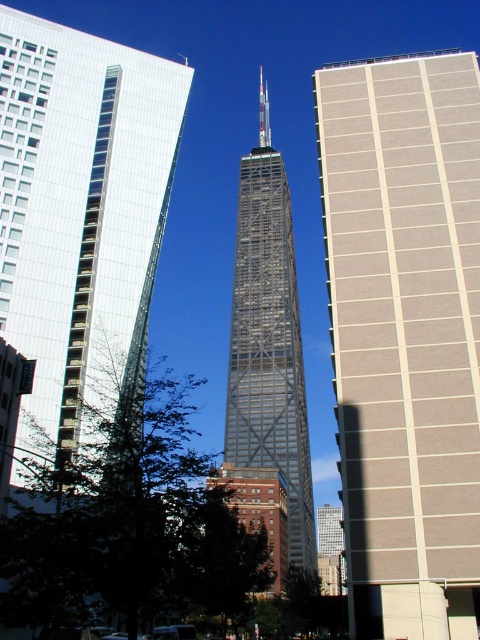
You are an urban planner analyzing the cityscape. You need to determine which of the two buildings, the beige textured building at right or the glassy reflective skyscraper at center, has a narrower width. Based on the scene, which one is it?

The beige textured building at right is thinner than the glassy reflective skyscraper at center, so the beige textured building at right has a narrower width.

You are an urban planner assessing the city layout. Given the beige textured building at right and the glassy steel tower at center, which one has a narrower horizontal span from left to right?

The beige textured building at right has a lesser width compared to the glassy steel tower at center, so it has a narrower horizontal span.

You are a city planner assessing the distance between two key buildings in the urban landscape. The beige textured building at right and the glassy steel tower at center are critical for a new transportation project. Given that the required minimum distance for safe construction is 100 meters, can the project proceed between these two buildings?

The beige textured building at right and the glassy steel tower at center are 108.04 meters apart, which exceeds the required minimum distance of 100 meters. Therefore, the project can proceed safely between these two buildings.